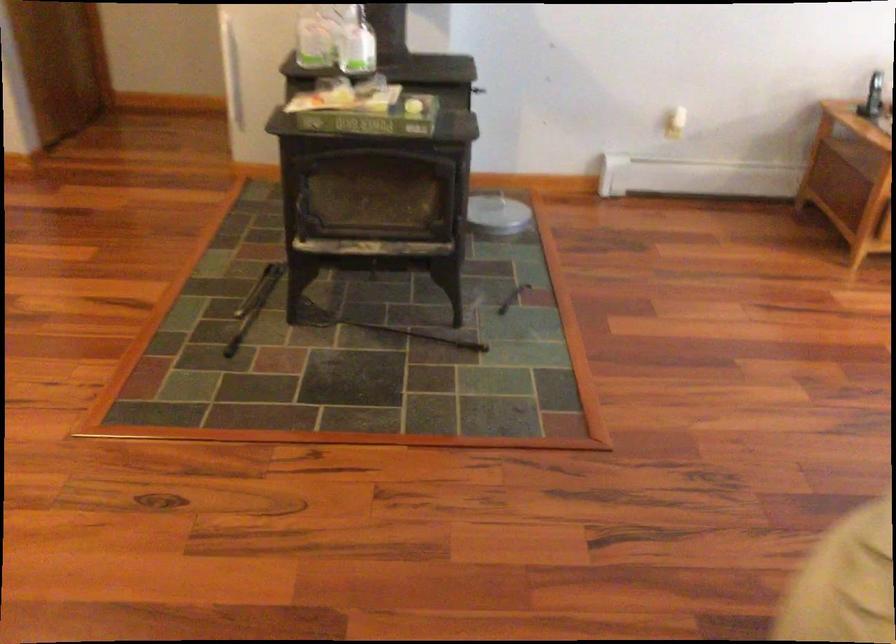
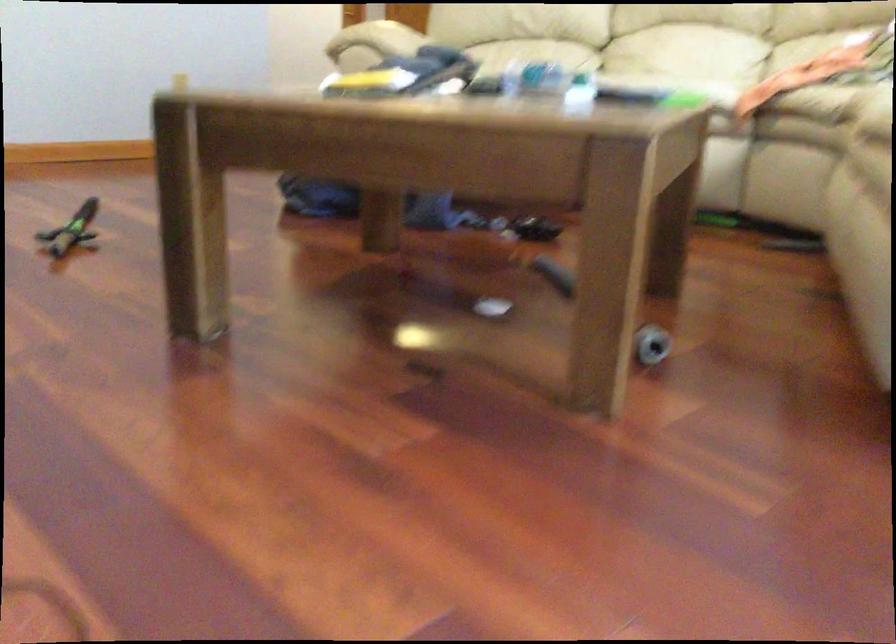
Question: I am providing you with two images of the same scene from different viewpoints. After the viewpoint changes to image2, which objects are now occluded?

Choices:
 (A) metal clothing rod
 (B) sofa sitting surface
 (C) green toy sword
 (D) black fireplace tool

Answer: (D)